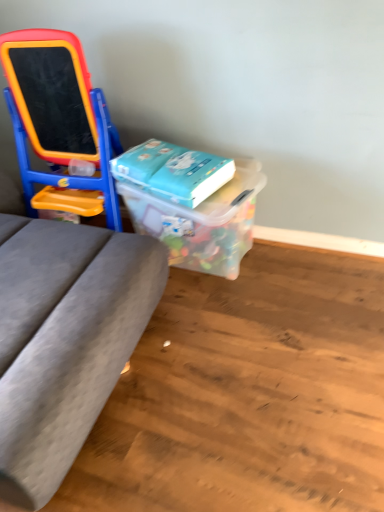
Where is `free space in front of translucent plastic container at center`? The height and width of the screenshot is (512, 384). free space in front of translucent plastic container at center is located at coordinates (222, 340).